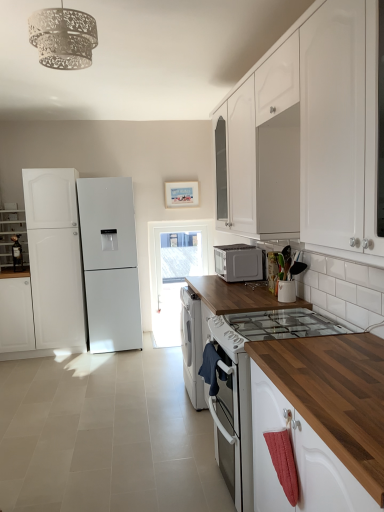
Question: Does white matte cabinet at upper center, which ranks as the 3th cabinetry in left-to-right order, have a lesser width compared to white matte refrigerator at left?

Choices:
 (A) yes
 (B) no

Answer: (A)

Question: Does white matte cabinet at upper center, the second cabinetry viewed from the front, have a larger size compared to white matte refrigerator at left?

Choices:
 (A) no
 (B) yes

Answer: (A)

Question: From the image's perspective, is white matte cabinet at upper center, which appears as the second cabinetry when viewed from the right, beneath white matte refrigerator at left?

Choices:
 (A) no
 (B) yes

Answer: (A)

Question: Would you consider white matte cabinet at upper center, the second cabinetry viewed from the front, to be distant from white matte refrigerator at left?

Choices:
 (A) no
 (B) yes

Answer: (B)

Question: Does white matte cabinet at upper center, the second cabinetry viewed from the front, come behind white matte refrigerator at left?

Choices:
 (A) no
 (B) yes

Answer: (A)

Question: Is white matte cabinet at left, which is the 2th cabinetry in back-to-front order, bigger or smaller than matte white cabinet at left, the 1th cabinetry in the back-to-front sequence?

Choices:
 (A) big
 (B) small

Answer: (A)

Question: Is white matte cabinet at left, marked as the 1th cabinetry in a left-to-right arrangement, situated inside matte white cabinet at left, acting as the third cabinetry starting from the right, or outside?

Choices:
 (A) inside
 (B) outside

Answer: (B)

Question: Considering their positions, is white matte cabinet at left, the fourth cabinetry from the right, located in front of or behind matte white cabinet at left, which is the 2th cabinetry from left to right?

Choices:
 (A) behind
 (B) front

Answer: (B)

Question: From a real-world perspective, is white matte cabinet at left, placed as the third cabinetry when sorted from front to back, physically located above or below matte white cabinet at left, acting as the third cabinetry starting from the right?

Choices:
 (A) above
 (B) below

Answer: (B)

Question: In terms of height, does satin silver microwave at center look taller or shorter compared to white matte cabinet at left, which is the 2th cabinetry in back-to-front order?

Choices:
 (A) short
 (B) tall

Answer: (A)

Question: Would you say satin silver microwave at center is inside or outside white matte cabinet at left, the fourth cabinetry from the right?

Choices:
 (A) outside
 (B) inside

Answer: (A)

Question: Is point (253, 251) closer or farther from the camera than point (28, 337)?

Choices:
 (A) closer
 (B) farther

Answer: (A)

Question: Is satin silver microwave at center wider or thinner than white matte cabinet at left, marked as the 1th cabinetry in a left-to-right arrangement?

Choices:
 (A) wide
 (B) thin

Answer: (B)

Question: Looking at the image, does matte white cabinet at left, acting as the third cabinetry starting from the right, seem bigger or smaller compared to white matte cabinet at left, the fourth cabinetry from the right?

Choices:
 (A) small
 (B) big

Answer: (A)

Question: Do you think matte white cabinet at left, acting as the third cabinetry starting from the right, is within white matte cabinet at left, marked as the 1th cabinetry in a left-to-right arrangement, or outside of it?

Choices:
 (A) outside
 (B) inside

Answer: (A)